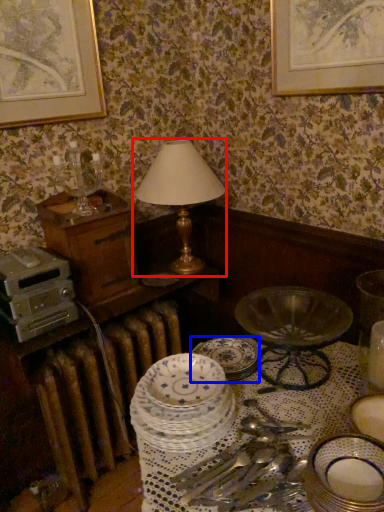
Question: Which of the following is the farthest to the observer, table lamp (highlighted by a red box) or plate (highlighted by a blue box)?

Choices:
 (A) table lamp
 (B) plate

Answer: (A)